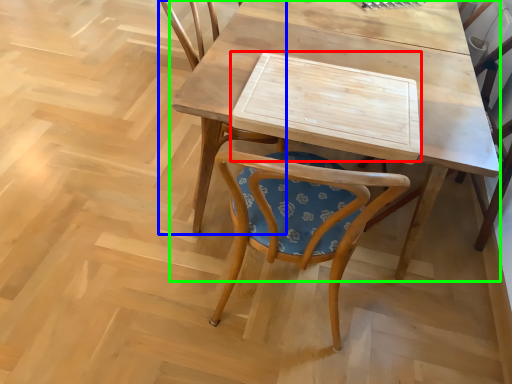
Question: Estimate the real-world distances between objects in this image. Which object is farther from plank (highlighted by a red box), chair (highlighted by a blue box) or table (highlighted by a green box)?

Choices:
 (A) chair
 (B) table

Answer: (A)